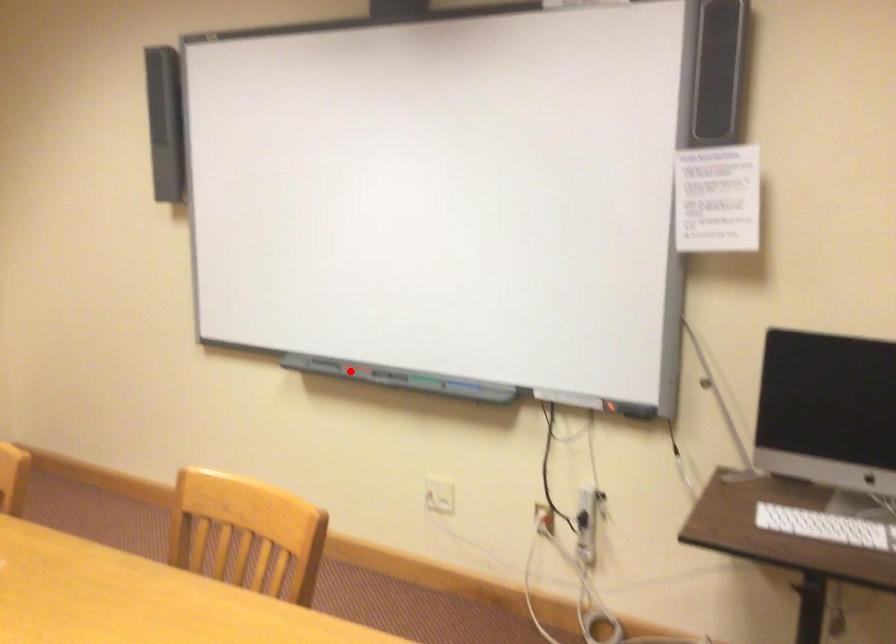
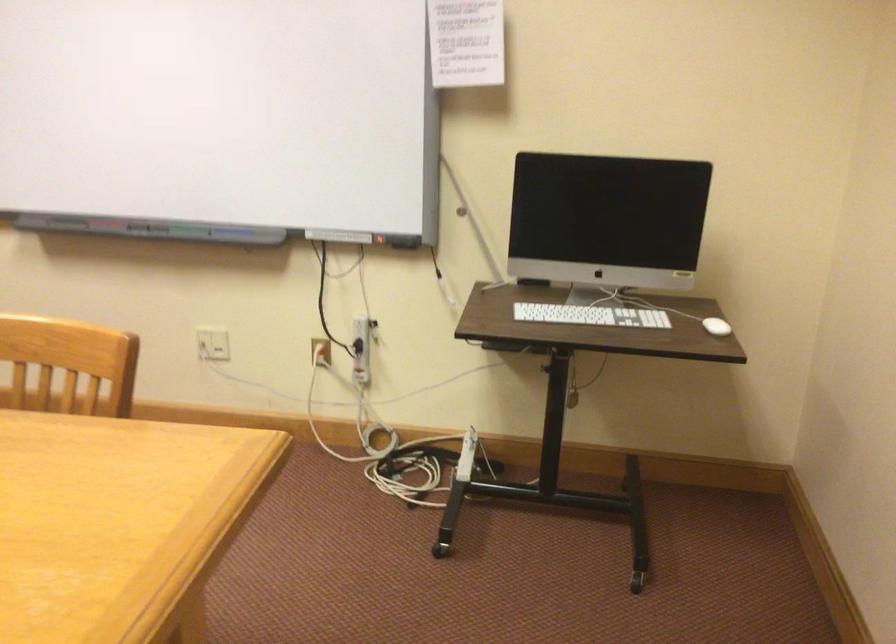
Question: I am providing you with two images of the same scene from different viewpoints. A red point is marked on the first image. At the location where the point appears in image 1, is it still visible in image 2?

Choices:
 (A) Yes
 (B) No

Answer: (A)